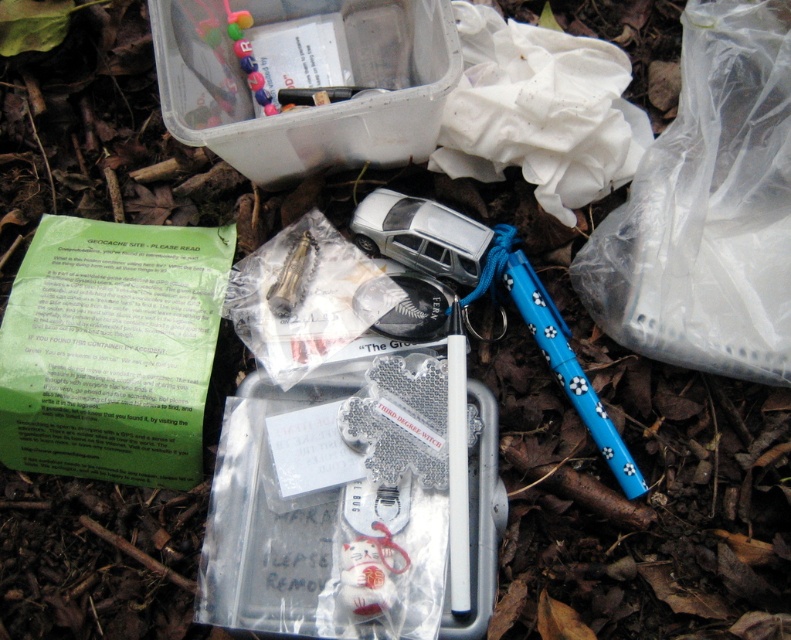
Question: Among these objects, which one is nearest to the camera?

Choices:
 (A) transparent plastic bag at upper right
 (B) porcelain white cat at center
 (C) blue plastic pen at lower right

Answer: (B)

Question: Which of the following is the closest to the observer?

Choices:
 (A) (542, 289)
 (B) (402, 570)

Answer: (B)

Question: Is transparent plastic bag at upper right to the right of blue plastic pen at lower right from the viewer's perspective?

Choices:
 (A) yes
 (B) no

Answer: (A)

Question: Can you confirm if blue plastic pen at lower right is bigger than porcelain white cat at center?

Choices:
 (A) no
 (B) yes

Answer: (B)

Question: Which object appears closest to the camera in this image?

Choices:
 (A) transparent plastic bag at upper right
 (B) blue plastic pen at lower right
 (C) porcelain white cat at center

Answer: (C)

Question: Does blue plastic pen at lower right have a larger size compared to porcelain white cat at center?

Choices:
 (A) no
 (B) yes

Answer: (B)